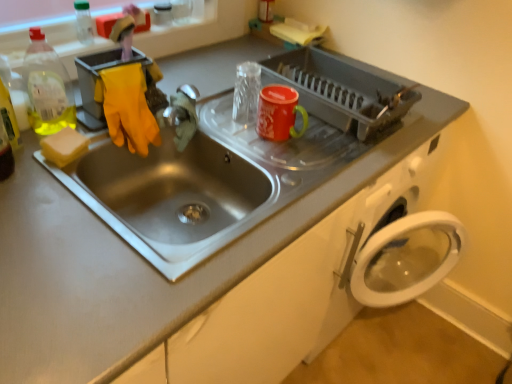
Question: In terms of size, does yellow sponge at left appear bigger or smaller than metallic silver faucet at sink center?

Choices:
 (A) small
 (B) big

Answer: (A)

Question: Is point 70,153 closer or farther from the camera than point 185,132?

Choices:
 (A) farther
 (B) closer

Answer: (B)

Question: Estimate the real-world distances between objects in this image. Which object is farther from the metallic silver faucet at sink center?

Choices:
 (A) matte plastic dish rack at upper center
 (B) yellow sponge at left
 (C) clear plastic bottle at upper left, acting as the first bottle starting from the top
 (D) translucent plastic bottle at upper left, which is the 1th bottle in front-to-back order

Answer: (C)

Question: Which object is positioned closest to the translucent plastic bottle at upper left, which ranks as the 1th bottle in bottom-to-top order?

Choices:
 (A) metallic silver faucet at sink center
 (B) yellow sponge at left
 (C) matte plastic dish rack at upper center
 (D) clear plastic bottle at upper left, which is the second bottle in bottom-to-top order

Answer: (B)